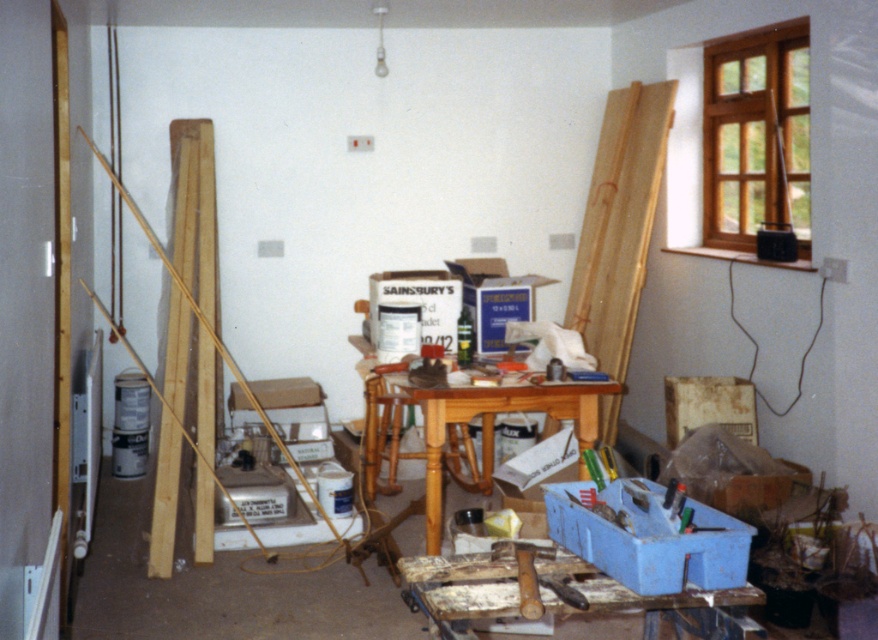
Question: In this image, where is light brown wooden ladder at center located relative to wooden table at center?

Choices:
 (A) right
 (B) left

Answer: (A)

Question: Does light brown wooden ladder at center appear on the right side of wooden table at center?

Choices:
 (A) yes
 (B) no

Answer: (A)

Question: In this image, where is light brown wooden ladder at center located relative to wooden table at center?

Choices:
 (A) left
 (B) right

Answer: (B)

Question: Which of the following is the closest to the observer?

Choices:
 (A) (652, 173)
 (B) (488, 410)

Answer: (B)

Question: Which of the following is the farthest from the observer?

Choices:
 (A) (603, 397)
 (B) (399, 365)

Answer: (A)